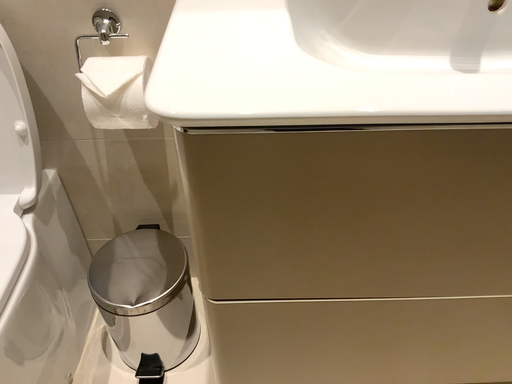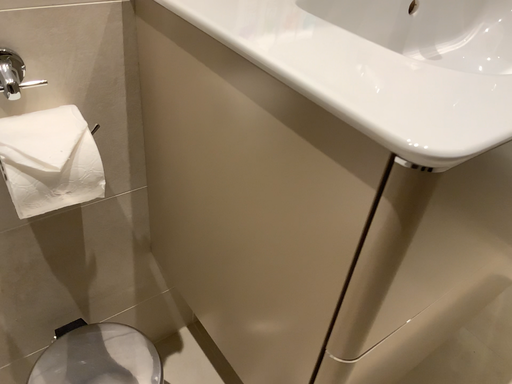
Question: Which way did the camera rotate in the video?

Choices:
 (A) rotated upward
 (B) rotated downward

Answer: (A)